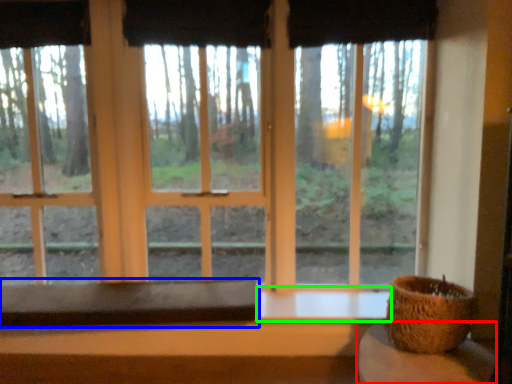
Question: Estimate the real-world distances between objects in this image. Which object is farther from table (highlighted by a red box), table (highlighted by a blue box) or window sill (highlighted by a green box)?

Choices:
 (A) table
 (B) window sill

Answer: (A)